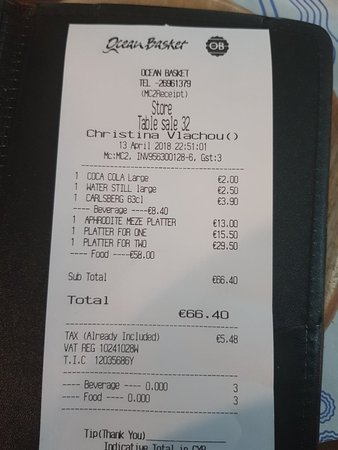
The height and width of the screenshot is (450, 338). In order to click on white printer tape paper in this screenshot , I will do `click(91, 69)`, `click(254, 248)`, `click(143, 281)`, `click(66, 423)`, `click(249, 429)`.